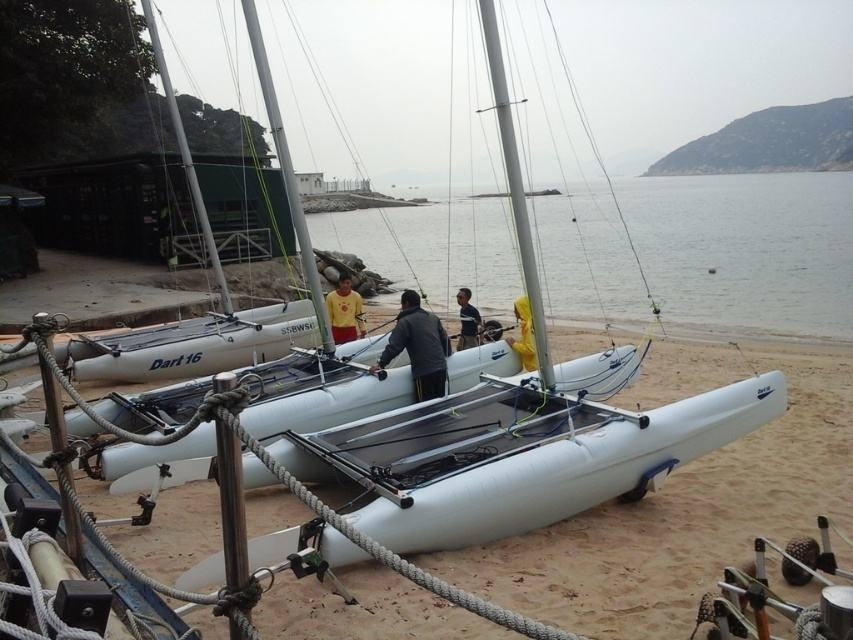
Question: Considering the relative positions of white matte sailboat at center and yellow fabric shirt at center in the image provided, where is white matte sailboat at center located with respect to yellow fabric shirt at center?

Choices:
 (A) below
 (B) above

Answer: (A)

Question: Can you confirm if dark gray fabric jacket at center is thinner than yellow waterproof jacket at center?

Choices:
 (A) yes
 (B) no

Answer: (B)

Question: Is white matte sailboat at center positioned behind yellow waterproof jacket at center?

Choices:
 (A) no
 (B) yes

Answer: (A)

Question: Which object is positioned closest to the white matte sailboat at center?

Choices:
 (A) dark gray fabric jacket at center
 (B) white matte water at center
 (C) yellow fabric shirt at center

Answer: (A)

Question: Which of the following is the closest to the observer?

Choices:
 (A) yellow matte shirt at center
 (B) yellow waterproof jacket at center
 (C) dark gray fabric jacket at center

Answer: (C)

Question: Which of the following is the farthest from the observer?

Choices:
 (A) yellow matte shirt at center
 (B) white matte water at center
 (C) yellow waterproof jacket at center
 (D) yellow fabric shirt at center

Answer: (B)